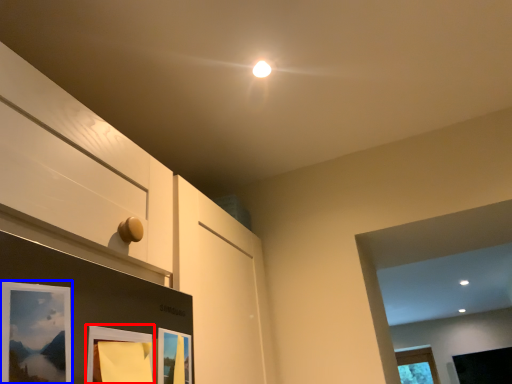
Question: Which object appears farthest to the camera in this image, picture frame (highlighted by a red box) or picture frame (highlighted by a blue box)?

Choices:
 (A) picture frame
 (B) picture frame

Answer: (A)